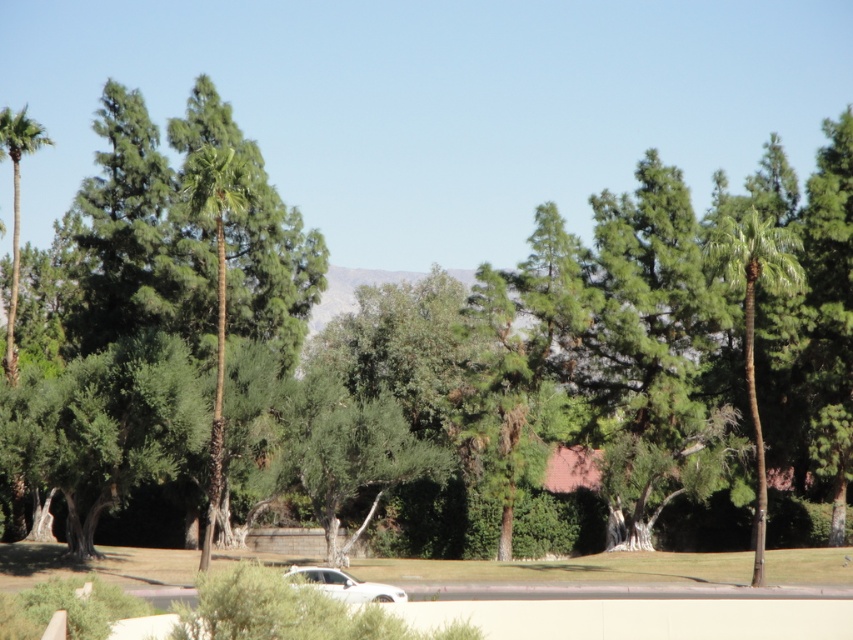
You are a photographer trying to capture the white matte car at lower center in your shot. However, you notice the green leafy palm tree at left might block the view. Based on their sizes, will the palm tree block the car?

The green leafy palm tree at left is taller than the white matte car at lower center, so it might block the view of the car depending on their positions.

You are standing in the middle of the scene and want to walk towards the green leafy palm tree at left. Which direction should you head to avoid the green textured palm tree at right?

To reach the green leafy palm tree at left while avoiding the green textured palm tree at right, you should head to the left side since the green textured palm tree at right is positioned on the right side of the green leafy palm tree at left.

You are a delivery person needing to park your vehicle, which is 5 meters long, between the green leafy palm tree at center and the white matte car at lower center. Is there enough space for your vehicle?

The green leafy palm tree at center is 7.64 meters from the white matte car at lower center. Since your vehicle is 5 meters long, there is sufficient space between them to park your vehicle.